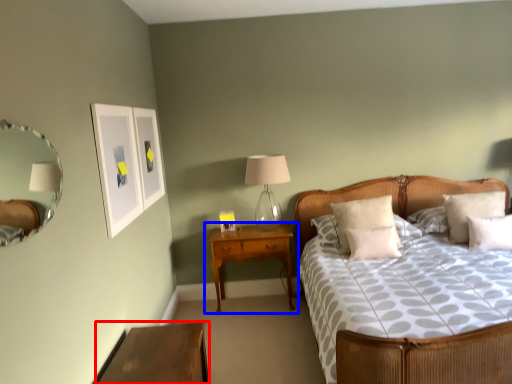
Question: Which object appears farthest to the camera in this image, nightstand (highlighted by a red box) or nightstand (highlighted by a blue box)?

Choices:
 (A) nightstand
 (B) nightstand

Answer: (B)